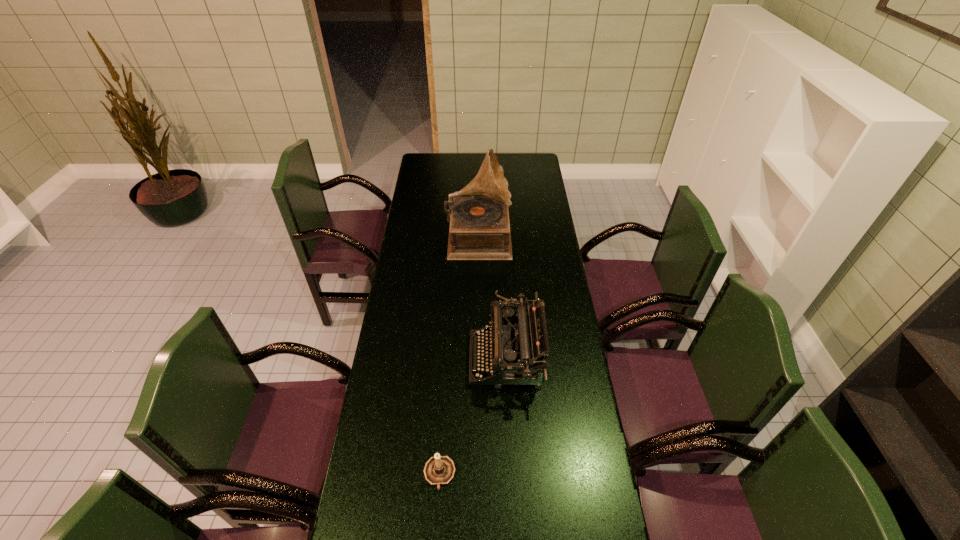
The height and width of the screenshot is (540, 960). Find the location of `vacant space located 0.190m on the back of the candle holder`. vacant space located 0.190m on the back of the candle holder is located at coordinates (444, 402).

Image resolution: width=960 pixels, height=540 pixels. Find the location of `object that is positioned at the right edge`. object that is positioned at the right edge is located at coordinates (518, 342).

The image size is (960, 540). In the image, there is a desktop. Identify the location of blank space at the far edge. (477, 170).

Where is `free space at the left edge of the desktop`? free space at the left edge of the desktop is located at coordinates (434, 234).

Image resolution: width=960 pixels, height=540 pixels. Identify the location of vacant space at the right edge. (565, 293).

The image size is (960, 540). Identify the location of vacant area at the far left corner of the desktop. point(421,172).

Identify the location of free space between the farthest object and the second tallest object. (492, 297).

Find the location of a particular element. Image resolution: width=960 pixels, height=540 pixels. empty space between the farthest object and the nearest object is located at coordinates (459, 354).

Image resolution: width=960 pixels, height=540 pixels. I want to click on vacant space that's between the second farthest object and the record player, so click(492, 297).

Identify the location of free space between the second farthest object and the record player. (492, 297).